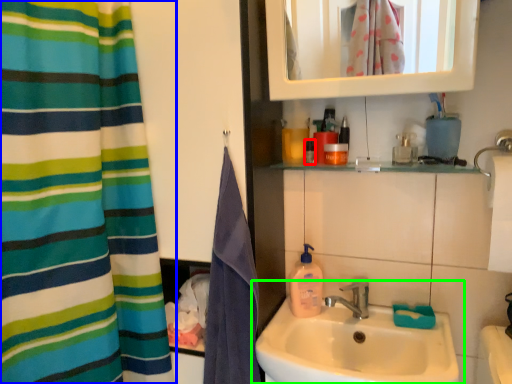
Question: Which is farther away from mouthwash (highlighted by a red box)? curtain (highlighted by a blue box) or sink (highlighted by a green box)?

Choices:
 (A) curtain
 (B) sink

Answer: (A)